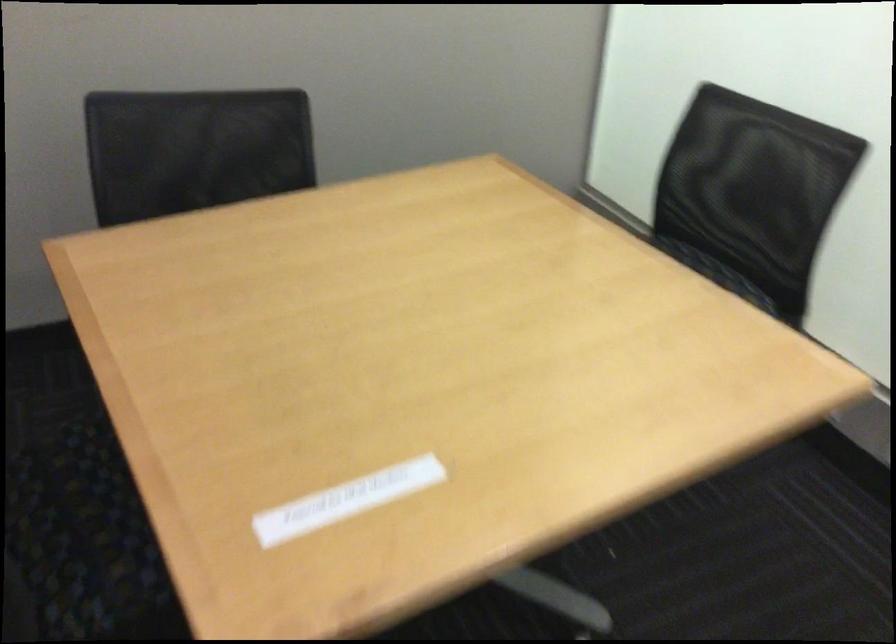
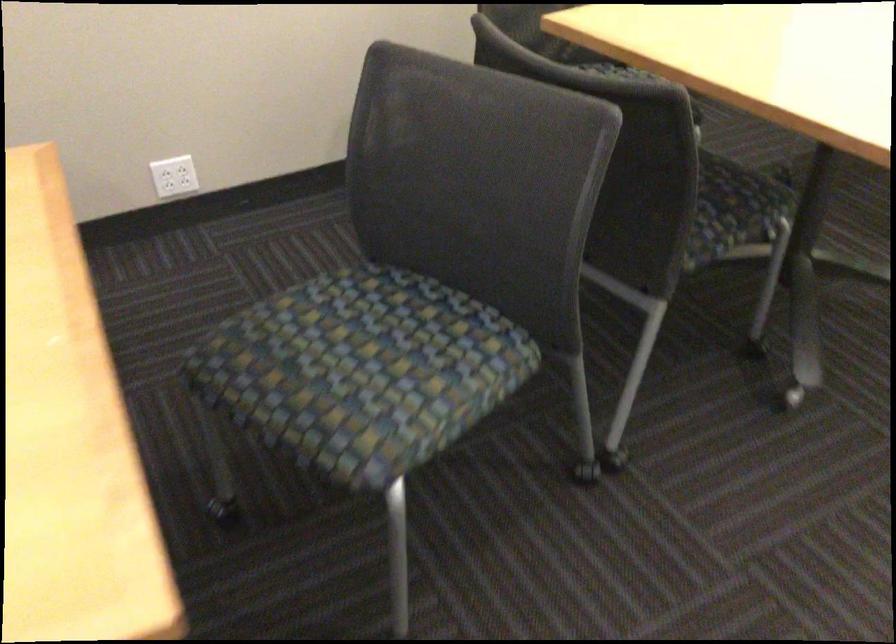
Question: The first image is from the beginning of the video and the second image is from the end. How did the camera likely rotate when shooting the video?

Choices:
 (A) Left
 (B) Right
 (C) Up
 (D) Down

Answer: (D)